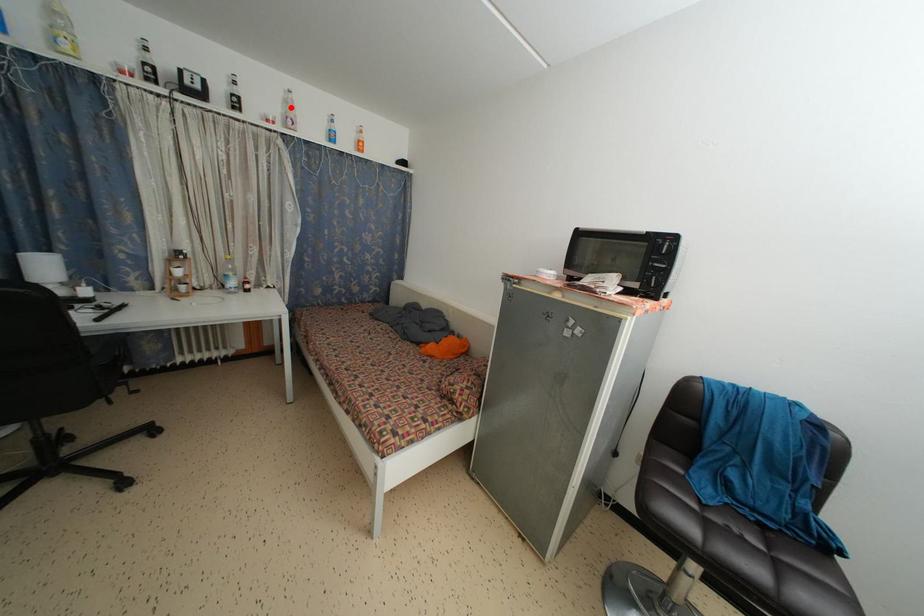
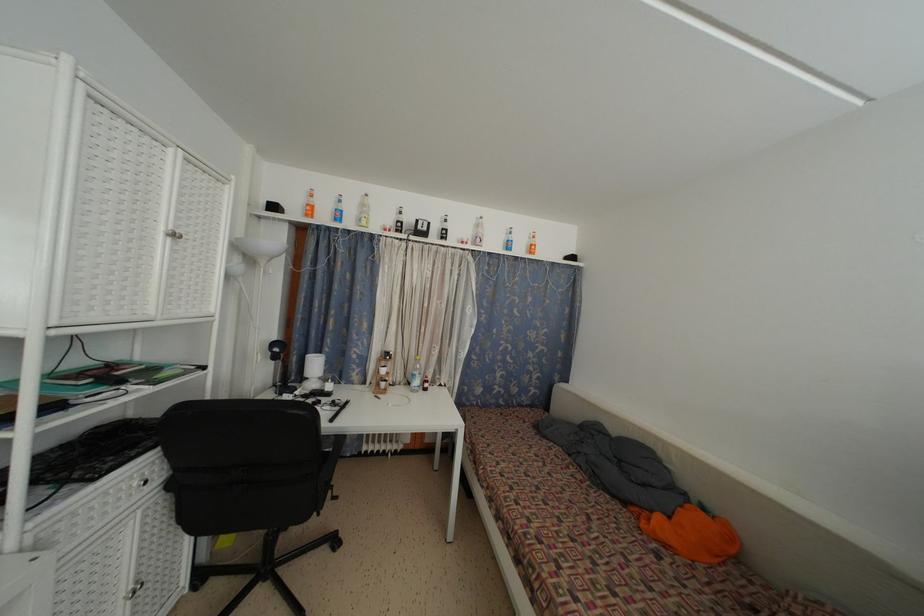
Find the pixel in the second image that matches the highlighted location in the first image.

(481, 232)